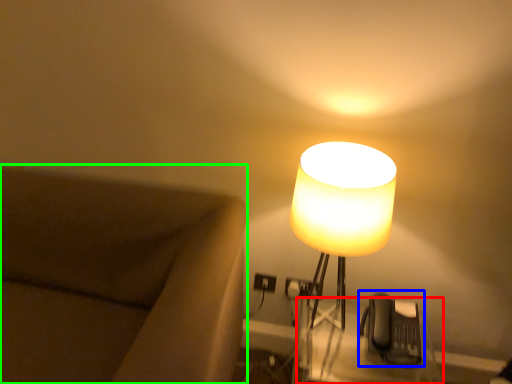
Question: Considering the real-world distances, which object is farthest from table (highlighted by a red box)? swivel chair (highlighted by a blue box) or furniture (highlighted by a green box)?

Choices:
 (A) swivel chair
 (B) furniture

Answer: (B)